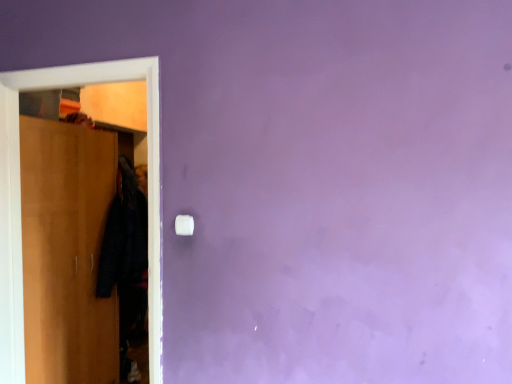
Question: Does wooden wardrobe at left have a lesser width compared to white plastic light switch at center?

Choices:
 (A) yes
 (B) no

Answer: (B)

Question: Is wooden wardrobe at left oriented towards white plastic light switch at center?

Choices:
 (A) yes
 (B) no

Answer: (A)

Question: Is wooden wardrobe at left next to white plastic light switch at center and touching it?

Choices:
 (A) yes
 (B) no

Answer: (B)

Question: Considering the relative sizes of wooden wardrobe at left and white plastic light switch at center in the image provided, is wooden wardrobe at left smaller than white plastic light switch at center?

Choices:
 (A) no
 (B) yes

Answer: (A)

Question: From a real-world perspective, is wooden wardrobe at left on top of white plastic light switch at center?

Choices:
 (A) yes
 (B) no

Answer: (B)

Question: Considering the positions of wooden wardrobe at left and white plastic light switch at center in the image, is wooden wardrobe at left wider or thinner than white plastic light switch at center?

Choices:
 (A) wide
 (B) thin

Answer: (A)

Question: In the image, is wooden wardrobe at left positioned in front of or behind white plastic light switch at center?

Choices:
 (A) behind
 (B) front

Answer: (A)

Question: From the image's perspective, is wooden wardrobe at left above or below white plastic light switch at center?

Choices:
 (A) above
 (B) below

Answer: (B)

Question: Is wooden wardrobe at left taller or shorter than white plastic light switch at center?

Choices:
 (A) tall
 (B) short

Answer: (A)

Question: Looking at the image, does wooden wardrobe at left seem bigger or smaller compared to black fabric coat at left?

Choices:
 (A) big
 (B) small

Answer: (A)

Question: Is wooden wardrobe at left to the left or to the right of black fabric coat at left in the image?

Choices:
 (A) left
 (B) right

Answer: (A)

Question: From the image's perspective, is wooden wardrobe at left positioned above or below black fabric coat at left?

Choices:
 (A) below
 (B) above

Answer: (A)

Question: Is wooden wardrobe at left inside the boundaries of black fabric coat at left, or outside?

Choices:
 (A) outside
 (B) inside

Answer: (A)

Question: Based on their sizes in the image, would you say black fabric coat at left is bigger or smaller than wooden wardrobe at left?

Choices:
 (A) small
 (B) big

Answer: (A)

Question: Considering the relative positions of black fabric coat at left and wooden wardrobe at left in the image provided, is black fabric coat at left to the left or to the right of wooden wardrobe at left?

Choices:
 (A) right
 (B) left

Answer: (A)